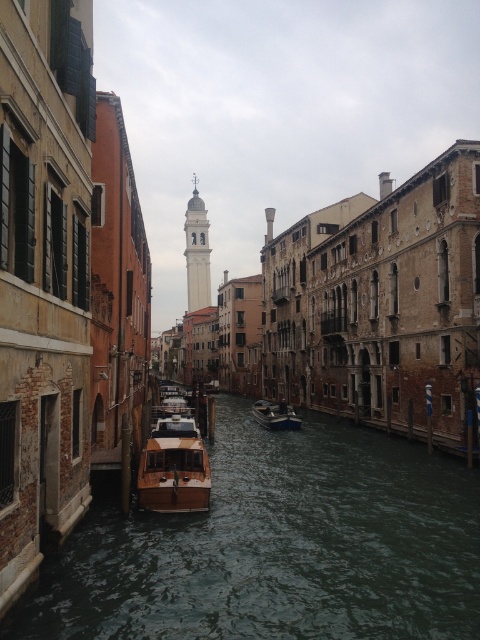
Based on the photo, who is higher up, greenish water at center or wooden boat at center?

wooden boat at center is higher up.

Is greenish water at center positioned before wooden boat at center?

Yes.

Does point (242, 496) come closer to viewer compared to point (197, 499)?

No, (242, 496) is behind (197, 499).

Identify the location of greenish water at center. (277, 547).

Who is more distant from viewer, (193, 467) or (200, 262)?

The point (200, 262) is behind.

How much distance is there between wooden boat at center and white marble bell tower at center?

365.66 meters

Is point (189, 451) less distant than point (192, 244)?

Yes, it is in front of point (192, 244).

Locate an element on the screen. wooden boat at center is located at coordinates (173, 467).

Does wooden boat at center appear on the right side of wooden polished boat at center?

Incorrect, wooden boat at center is not on the right side of wooden polished boat at center.

Is point (168, 486) farther from viewer compared to point (254, 408)?

No, it is not.

Identify the location of wooden boat at center. This screenshot has width=480, height=640. (173, 467).

Locate an element on the screen. The image size is (480, 640). wooden boat at center is located at coordinates (173, 467).